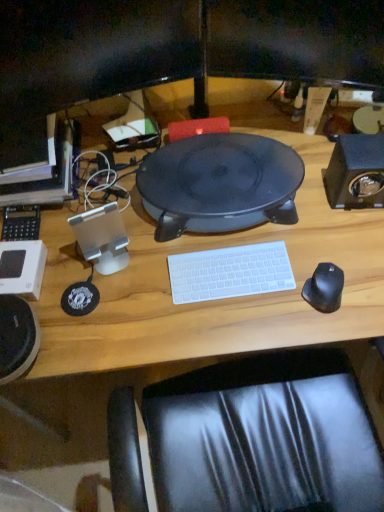
You are a GUI agent. You are given a task and a screenshot of the screen. Output one action in this format:
    pyautogui.click(x=<x>, y=<y>)
    Task: Click on the vacant area situated below white plastic keyboard at center (from a real-world perspective)
    
    Given the screenshot: What is the action you would take?
    pyautogui.click(x=230, y=274)